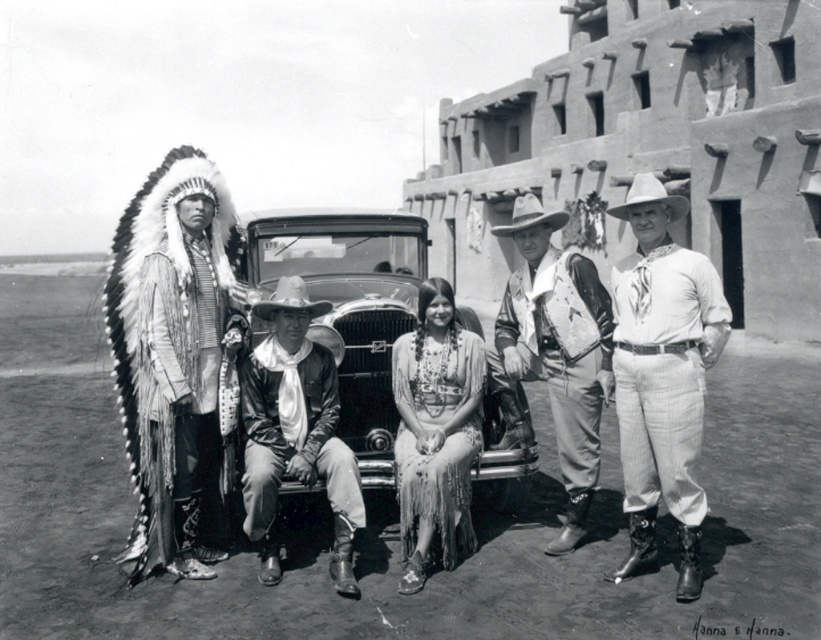
You are a photographer adjusting your camera to focus on the white feathered headdress at left and the white felt cowboy hat at upper right. Which object should you focus on first to ensure it appears sharp in the foreground?

The white feathered headdress at left is closer to the viewer than the white felt cowboy hat at upper right, so you should focus on the white feathered headdress at left first to ensure it appears sharp in the foreground.

You are a photographer who needs to capture a closeup shot of both the white feathered headdress at left and the white felt cowboy hat at upper right in the scene. Given that your camera has a maximum focus range of 4 meters, can you photograph both objects in one shot without moving the camera?

The white feathered headdress at left is 4.42 meters away from the white felt cowboy hat at upper right. Since the distance between them exceeds the camera maximum focus range of 4 meters, you cannot photograph both objects in one shot without moving the camera.